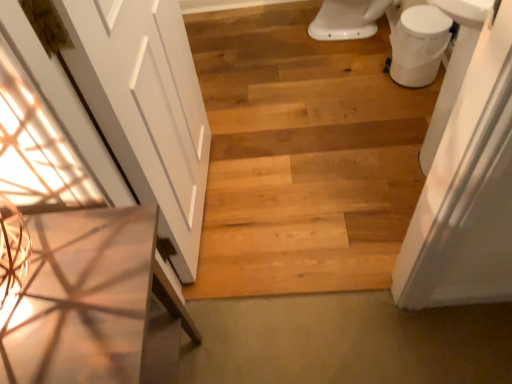
Question: In terms of size, does white glossy toilet bowl at upper right appear bigger or smaller than wooden table at left?

Choices:
 (A) big
 (B) small

Answer: (B)

Question: Considering the positions of point (449, 36) and point (117, 340), is point (449, 36) closer or farther from the camera than point (117, 340)?

Choices:
 (A) closer
 (B) farther

Answer: (B)

Question: Estimate the real-world distances between objects in this image. Which object is farther from the natural wood floor at center?

Choices:
 (A) white matte door at left
 (B) natural wood plank at center
 (C) wooden table at left
 (D) white glossy toilet bowl at upper right

Answer: (C)

Question: Which object is positioned closest to the wooden table at left?

Choices:
 (A) natural wood plank at center
 (B) white matte door at left
 (C) natural wood floor at center
 (D) white glossy toilet bowl at upper right

Answer: (B)